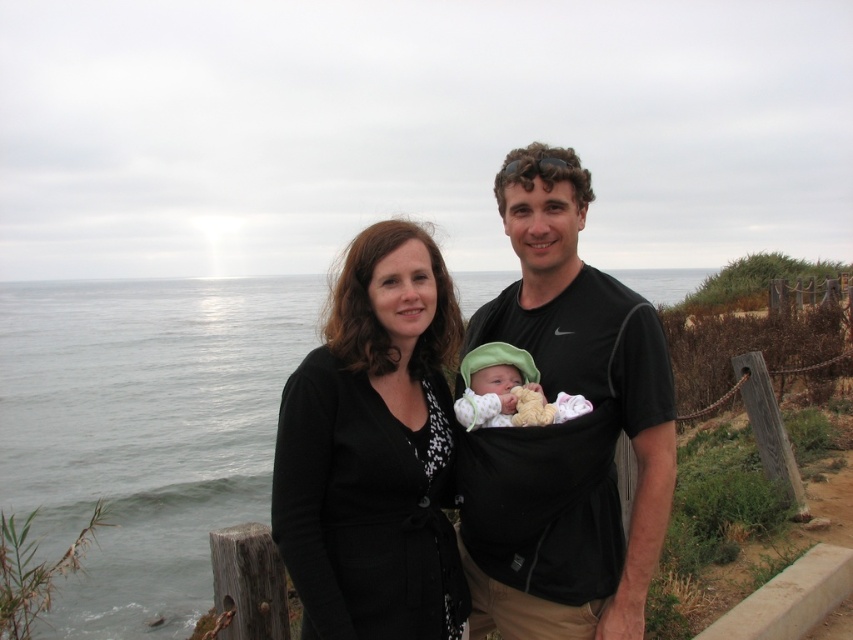
Question: Can you confirm if clear water at center is smaller than black matte/black textured cardigan at center?

Choices:
 (A) yes
 (B) no

Answer: (B)

Question: Can you confirm if clear water at center is wider than black fabric baby carrier at center?

Choices:
 (A) yes
 (B) no

Answer: (A)

Question: Which of the following is the closest to the observer?

Choices:
 (A) coord(314,346)
 (B) coord(488,348)
 (C) coord(585,563)

Answer: (C)

Question: Which is nearer to the black matte/black textured cardigan at center?

Choices:
 (A) clear water at center
 (B) soft green knit hat at center
 (C) black fabric baby carrier at center

Answer: (B)

Question: Does clear water at center have a lesser width compared to black fabric baby carrier at center?

Choices:
 (A) no
 (B) yes

Answer: (A)

Question: Based on their relative distances, which object is nearer to the soft green knit hat at center?

Choices:
 (A) clear water at center
 (B) black fabric baby carrier at center

Answer: (B)